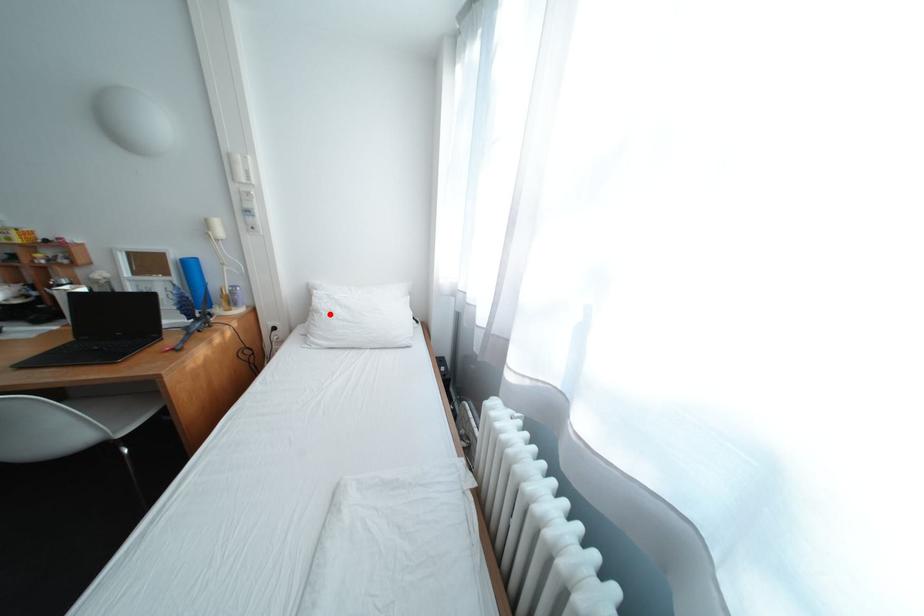
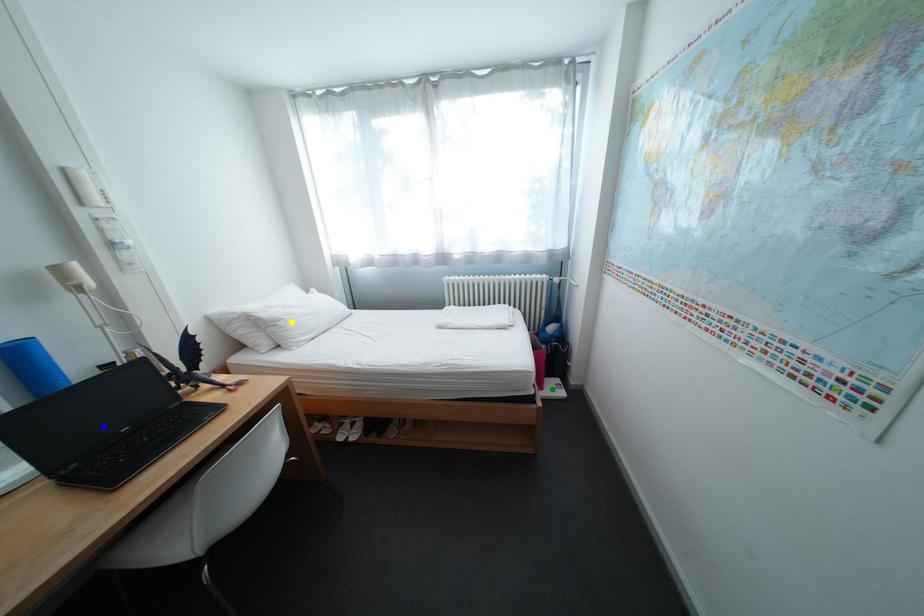
Question: I am providing you with two images of the same scene from different viewpoints. A red point is marked on the first image. You are given multiple points on the second image. In image 2, which mark is for the same physical point as the one in image 1?

Choices:
 (A) yellow point
 (B) blue point
 (C) green point

Answer: (A)